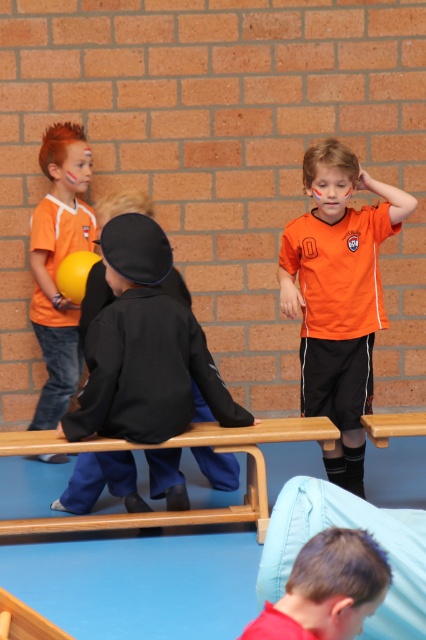
Does orange matte jersey at center appear over red matte shirt at lower center?

Indeed, orange matte jersey at center is positioned over red matte shirt at lower center.

Can you confirm if orange matte jersey at center is taller than red matte shirt at lower center?

Indeed, orange matte jersey at center has a greater height compared to red matte shirt at lower center.

Who is more forward, (302, 356) or (382, 557)?

Point (382, 557) is in front.

Locate an element on the screen. The image size is (426, 640). orange matte jersey at center is located at coordinates (339, 296).

Does black matte uniform at center have a greater width compared to matte orange shirt at left?

Yes, black matte uniform at center is wider than matte orange shirt at left.

Does black matte uniform at center have a lesser height compared to matte orange shirt at left?

Indeed, black matte uniform at center has a lesser height compared to matte orange shirt at left.

Is point (112, 388) farther from camera compared to point (31, 316)?

That is False.

Identify the location of black matte uniform at center. The width and height of the screenshot is (426, 640). (144, 348).

In the scene shown: Which is more to the left, orange matte jersey at center or matte orange shirt at left?

matte orange shirt at left is more to the left.

Locate an element on the screen. Image resolution: width=426 pixels, height=640 pixels. orange matte jersey at center is located at coordinates (339, 296).